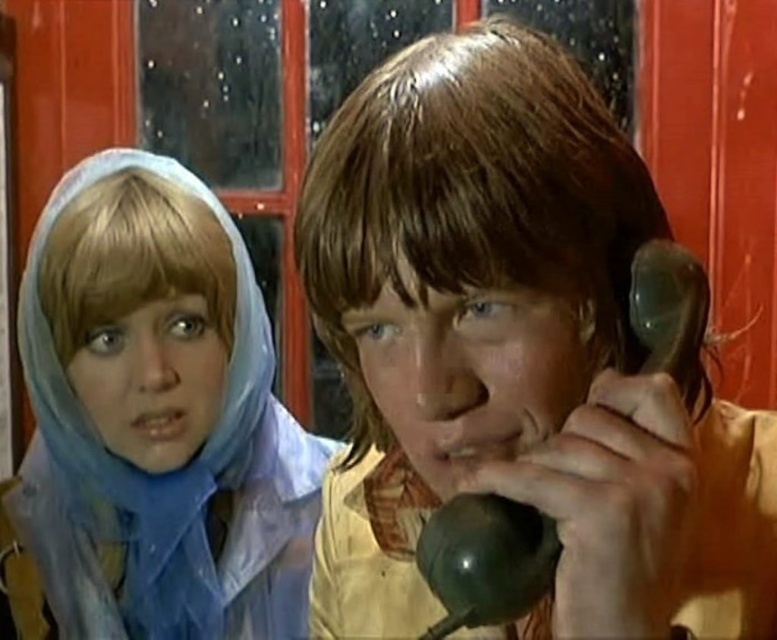
In the vintage scene, there are two people and a red door with a window. The point at coordinates (514,355) is somewhere in the image. Which object from the following list is this point located on? The options are shiny brown hair at center, light blue headscarf, or red door with window.

The point at coordinates (514,355) is located on the shiny brown hair at center.

You are standing at the red door with a window. There are two points marked in the image. The first point is at coordinate point (409, 129) and the second point is at coordinate point (227, 355). Which point is closer to you?

Point (409, 129) is in front of point (227, 355), so it is closer to you.